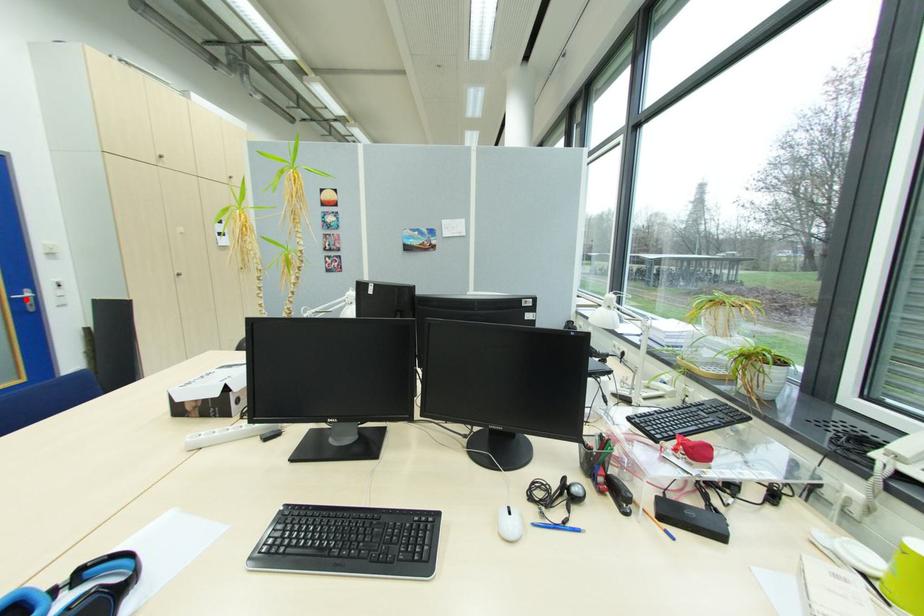
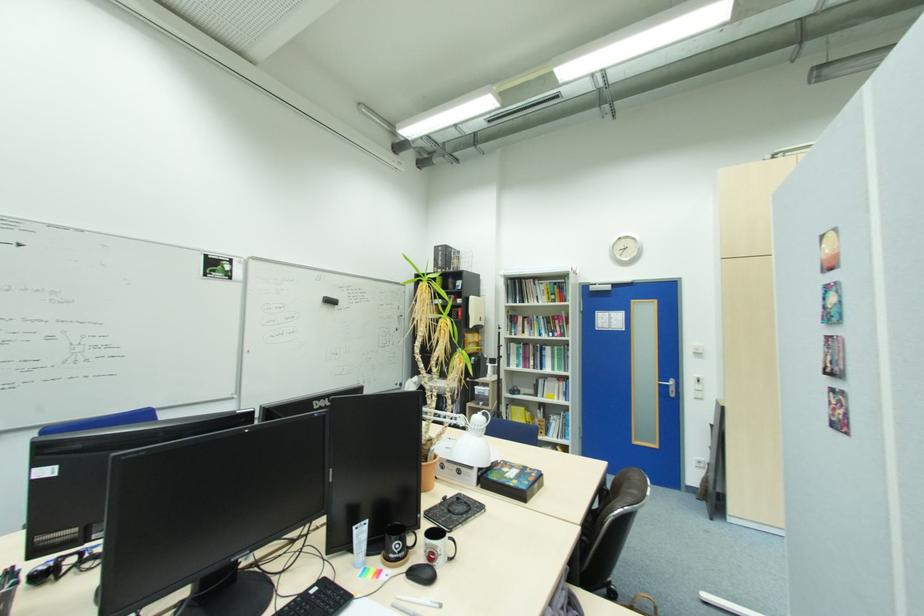
In the second image, find the point that corresponds to the highlighted location in the first image.

(671, 386)